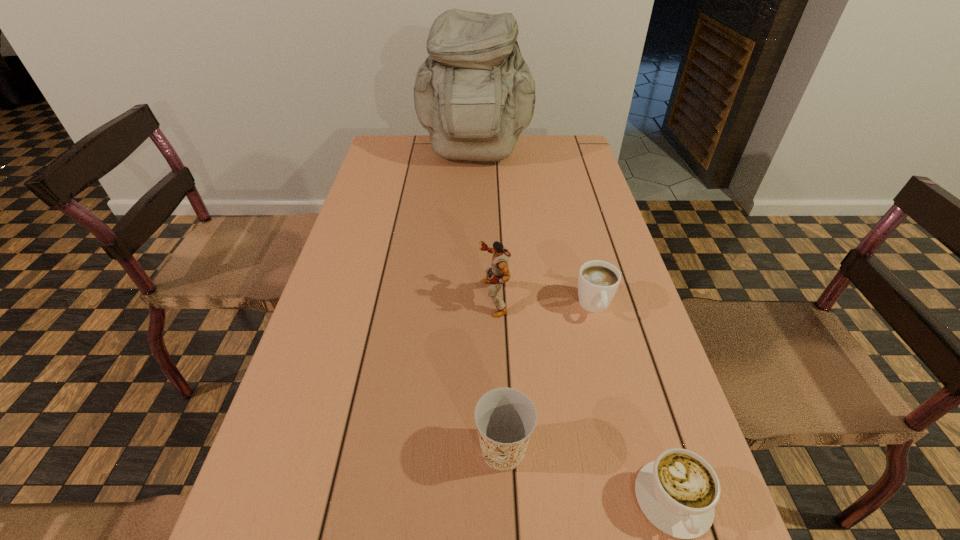
The height and width of the screenshot is (540, 960). I want to click on vacant space situated 0.320m on the left of the third tallest object, so click(292, 450).

Where is `free space located 0.310m with the handle on the side of the farther cappuccino`? The image size is (960, 540). free space located 0.310m with the handle on the side of the farther cappuccino is located at coordinates (636, 464).

This screenshot has width=960, height=540. In order to click on object at the far edge in this screenshot , I will do `click(475, 94)`.

Locate an element on the screen. object present at the left edge is located at coordinates (475, 94).

At what (x,y) coordinates should I click in order to perform the action: click on object present at the right edge. Please return your answer as a coordinate pair (x, y). The height and width of the screenshot is (540, 960). Looking at the image, I should click on (598, 281).

Locate an element on the screen. The height and width of the screenshot is (540, 960). object that is positioned at the far left corner is located at coordinates (475, 94).

Locate an element on the screen. Image resolution: width=960 pixels, height=540 pixels. vacant point at the left edge is located at coordinates (315, 401).

This screenshot has width=960, height=540. Find the location of `free spot at the right edge of the desktop`. free spot at the right edge of the desktop is located at coordinates (564, 240).

I want to click on free space between the taller cappuccino and the Dixie cup, so click(549, 378).

Locate an element on the screen. The width and height of the screenshot is (960, 540). vacant area that lies between the Dixie cup and the second tallest object is located at coordinates (498, 374).